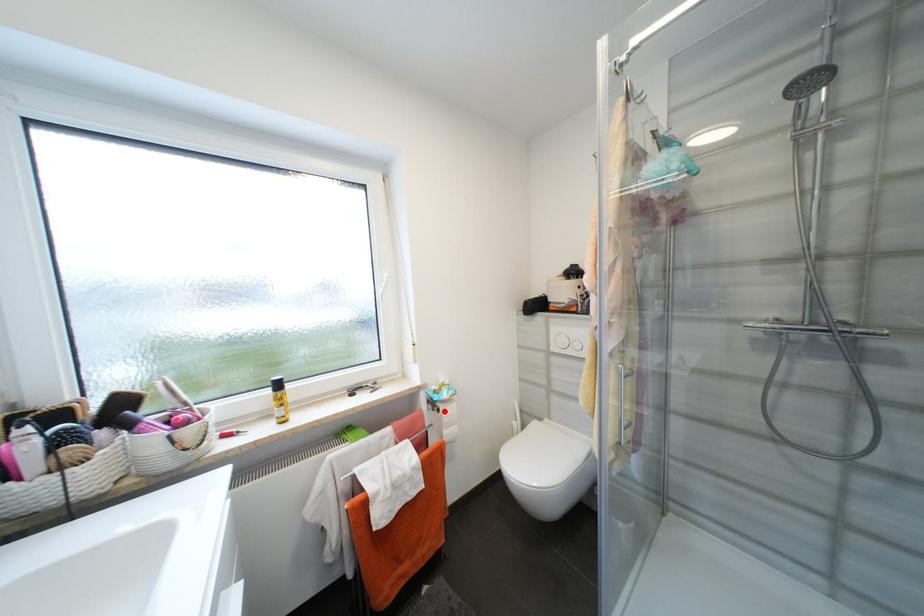
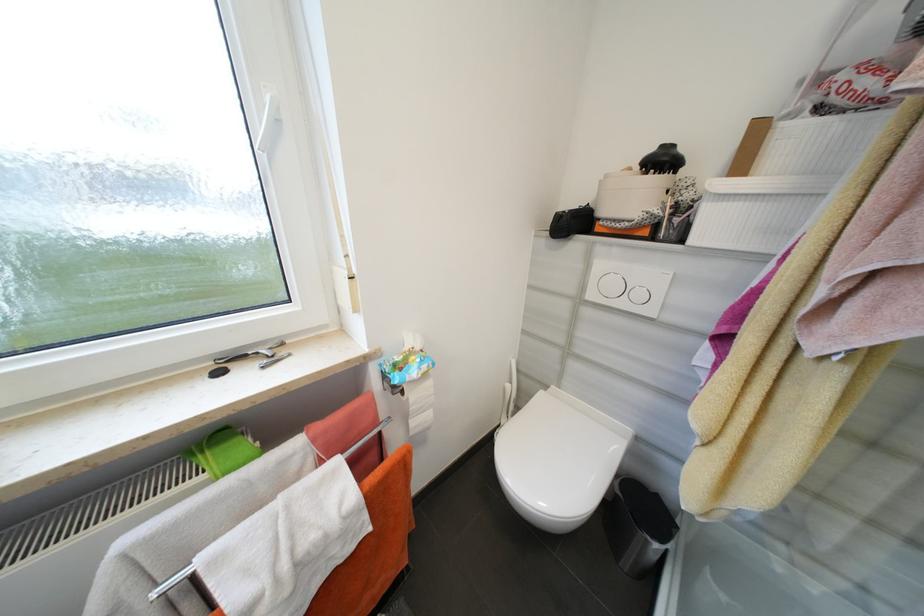
The point at the highlighted location is marked in the first image. Where is the corresponding point in the second image?

(407, 392)